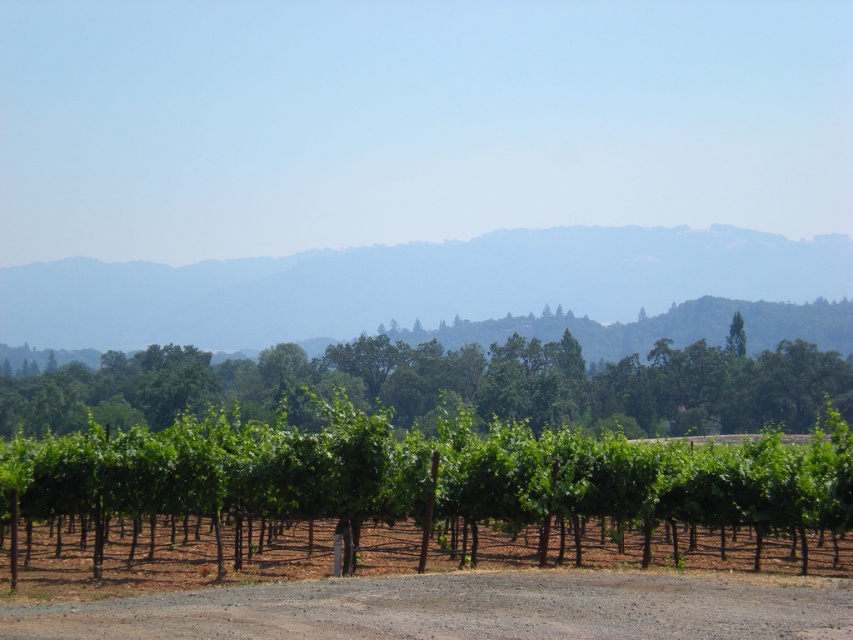
What do you see at coordinates (428, 477) in the screenshot? I see `green leafy vines at center` at bounding box center [428, 477].

Where is `green leafy vines at center`? green leafy vines at center is located at coordinates (428, 477).

Identify the location of green leafy vines at center. (428, 477).

Does point (82, 461) come farther from viewer compared to point (241, 384)?

No, it is not.

Describe the element at coordinates (428, 477) in the screenshot. I see `green leafy vines at center` at that location.

Locate an element on the screen. The height and width of the screenshot is (640, 853). green leafy vines at center is located at coordinates (428, 477).

Where is `green leafy vines at center`? Image resolution: width=853 pixels, height=640 pixels. green leafy vines at center is located at coordinates (428, 477).

Image resolution: width=853 pixels, height=640 pixels. What do you see at coordinates (428, 477) in the screenshot?
I see `green leafy vines at center` at bounding box center [428, 477].

Can you confirm if green leafy vines at center is positioned to the left of brown gravel road at center?

Indeed, green leafy vines at center is positioned on the left side of brown gravel road at center.

The width and height of the screenshot is (853, 640). Describe the element at coordinates (428, 477) in the screenshot. I see `green leafy vines at center` at that location.

At what (x,y) coordinates should I click in order to perform the action: click on green leafy vines at center. Please return your answer as a coordinate pair (x, y). Looking at the image, I should click on (428, 477).